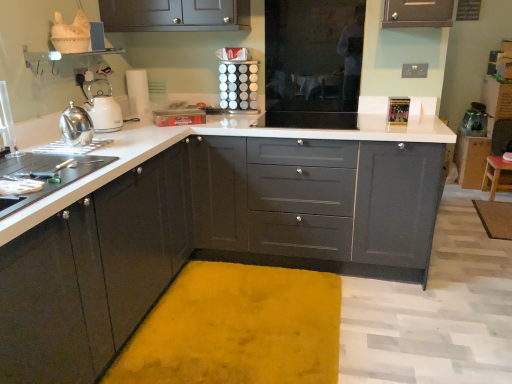
The height and width of the screenshot is (384, 512). Describe the element at coordinates (103, 108) in the screenshot. I see `white glossy kettle at left, which is counted as the 2th kitchen appliance, starting from the front` at that location.

At what (x,y) coordinates should I click in order to perform the action: click on white glossy kettle at left, which is counted as the 2th kitchen appliance, starting from the front. Please return your answer as a coordinate pair (x, y). This screenshot has height=384, width=512. Looking at the image, I should click on (103, 108).

What do you see at coordinates (237, 329) in the screenshot?
I see `yellow plush bath mat at center, which is counted as the 2th bath mat, starting from the right` at bounding box center [237, 329].

What is the approximate height of white glossy countertop at center?

white glossy countertop at center is 35.22 inches in height.

Locate an element on the screen. wooden stool at lower right is located at coordinates coord(497,176).

Does point (241, 80) lie in front of point (108, 97)?

No, (241, 80) is behind (108, 97).

Could you tell me if metallic silver spice rack at upper center is facing white glossy kettle at left, which appears as the first kitchen appliance when viewed from the back?

No, metallic silver spice rack at upper center is not oriented towards white glossy kettle at left, which appears as the first kitchen appliance when viewed from the back.

Is the position of metallic silver spice rack at upper center more distant than that of white glossy kettle at left, which appears as the first kitchen appliance when viewed from the back?

Yes.

Is metallic silver spice rack at upper center bigger or smaller than white glossy kettle at left, which is counted as the 2th kitchen appliance, starting from the front?

Considering their sizes, metallic silver spice rack at upper center takes up more space than white glossy kettle at left, which is counted as the 2th kitchen appliance, starting from the front.

From a real-world perspective, does matte gray cabinet at right, which is counted as the 3th cabinetry, starting from the left, stand above metallic silver spice rack at upper center?

Incorrect, from a real-world perspective, matte gray cabinet at right, which is counted as the 3th cabinetry, starting from the left, is lower than metallic silver spice rack at upper center.

Is matte gray cabinet at right, which ranks as the first cabinetry in back-to-front order, facing away from metallic silver spice rack at upper center?

matte gray cabinet at right, which ranks as the first cabinetry in back-to-front order, is not turned away from metallic silver spice rack at upper center.

Visually, is matte gray cabinet at right, which ranks as the first cabinetry in back-to-front order, positioned to the left or to the right of metallic silver spice rack at upper center?

matte gray cabinet at right, which ranks as the first cabinetry in back-to-front order, is positioned on metallic silver spice rack at upper center's right side.

Who is taller, wooden stool at lower right or yellow plush bath mat at lower right, the 2th bath mat viewed from the left?

Standing taller between the two is wooden stool at lower right.

Are wooden stool at lower right and yellow plush bath mat at lower right, the 1th bath mat from the top, located far from each other?

No, wooden stool at lower right is not far away from yellow plush bath mat at lower right, the 1th bath mat from the top.

Looking at their sizes, would you say wooden stool at lower right is wider or thinner than yellow plush bath mat at lower right, the 1th bath mat from the top?

In the image, wooden stool at lower right appears to be more narrow than yellow plush bath mat at lower right, the 1th bath mat from the top.

From a real-world perspective, is wooden stool at lower right positioned above or below yellow plush bath mat at lower right, the 2th bath mat viewed from the left?

wooden stool at lower right is situated higher than yellow plush bath mat at lower right, the 2th bath mat viewed from the left, in the real world.

Which is nearer, (81, 134) or (138, 363)?

Positioned in front is point (138, 363).

Does shiny metallic kettle at left, the 2th kitchen appliance when ordered from back to front, have a smaller size compared to yellow plush bath mat at center, positioned as the first bath mat in left-to-right order?

Yes.

Does shiny metallic kettle at left, acting as the first kitchen appliance starting from the front, have a greater height compared to yellow plush bath mat at center, the 2th bath mat positioned from the top?

Yes.

From the image's perspective, which one is positioned higher, shiny metallic kettle at left, the 2th kitchen appliance when ordered from back to front, or yellow plush bath mat at center, which is counted as the 2th bath mat, starting from the right?

shiny metallic kettle at left, the 2th kitchen appliance when ordered from back to front.

At what (x,y) coordinates should I click in order to perform the action: click on kitchen appliance that is the 1st object to the left of the yellow plush bath mat at center, which is counted as the 2th bath mat, starting from the right, starting at the anchor. Please return your answer as a coordinate pair (x, y). The image size is (512, 384). Looking at the image, I should click on (76, 126).

Can you confirm if yellow plush bath mat at center, placed as the 1th bath mat when sorted from front to back, is taller than shiny metallic kettle at left, the 2th kitchen appliance when ordered from back to front?

In fact, yellow plush bath mat at center, placed as the 1th bath mat when sorted from front to back, may be shorter than shiny metallic kettle at left, the 2th kitchen appliance when ordered from back to front.

Considering the points (297, 335) and (73, 142), which point is in front, point (297, 335) or point (73, 142)?

The point (73, 142) is more forward.

Locate an element on the screen. This screenshot has height=384, width=512. stool located underneath the matte gray cabinet at right, arranged as the third cabinetry when viewed from the front (from a real-world perspective) is located at coordinates (497, 176).

Looking at this image, from the image's perspective, which one is positioned lower, wooden stool at lower right or matte gray cabinet at right, which ranks as the first cabinetry in back-to-front order?

wooden stool at lower right is shown below in the image.

How many degrees apart are the facing directions of wooden stool at lower right and matte gray cabinet at right, which is counted as the 3th cabinetry, starting from the left?

The facing directions of wooden stool at lower right and matte gray cabinet at right, which is counted as the 3th cabinetry, starting from the left, are 2.92 degrees apart.

Can you confirm if wooden stool at lower right is smaller than matte gray cabinet at right, arranged as the third cabinetry when viewed from the front?

Correct, wooden stool at lower right occupies less space than matte gray cabinet at right, arranged as the third cabinetry when viewed from the front.

Is point (115, 131) closer to camera compared to point (432, 139)?

No, (115, 131) is further to viewer.

Looking at this image, considering the relative positions of white glossy kettle at left, which appears as the first kitchen appliance when viewed from the back, and white glossy countertop at center in the image provided, is white glossy kettle at left, which appears as the first kitchen appliance when viewed from the back, to the left of white glossy countertop at center from the viewer's perspective?

Indeed, white glossy kettle at left, which appears as the first kitchen appliance when viewed from the back, is positioned on the left side of white glossy countertop at center.

Between white glossy kettle at left, which is counted as the 2th kitchen appliance, starting from the front, and white glossy countertop at center, which one has larger width?

white glossy countertop at center.

Is white glossy kettle at left, which is counted as the 2th kitchen appliance, starting from the front, touching white glossy countertop at center?

white glossy kettle at left, which is counted as the 2th kitchen appliance, starting from the front, and white glossy countertop at center are clearly separated.

This screenshot has height=384, width=512. Find the location of `the 1st kitchen appliance positioned below the metallic silver spice rack at upper center (from the image's perspective)`. the 1st kitchen appliance positioned below the metallic silver spice rack at upper center (from the image's perspective) is located at coordinates (103, 108).

In order to click on appliance located in front of the matte gray cabinet at right, arranged as the third cabinetry when viewed from the front in this screenshot , I will do `click(238, 85)`.

When comparing their distances from matte black cabinets at left, the 3th cabinetry from the right, does shiny metallic kettle at left, acting as the first kitchen appliance starting from the front, or yellow plush bath mat at center, placed as the first bath mat when sorted from bottom to top, seem further?

shiny metallic kettle at left, acting as the first kitchen appliance starting from the front, is further to matte black cabinets at left, the 3th cabinetry from the right.

When comparing their distances from white glossy kettle at left, which appears as the first kitchen appliance when viewed from the back, does white glossy countertop at center or wooden stool at lower right seem further?

wooden stool at lower right is positioned further to the anchor white glossy kettle at left, which appears as the first kitchen appliance when viewed from the back.

Based on their spatial positions, is matte gray cabinet at right, which ranks as the first cabinetry in right-to-left order, or white glossy kettle at left, which is counted as the 2th kitchen appliance, starting from the front, closer to shiny metallic kettle at left, the 2th kitchen appliance when ordered from back to front?

white glossy kettle at left, which is counted as the 2th kitchen appliance, starting from the front, is positioned closer to the anchor shiny metallic kettle at left, the 2th kitchen appliance when ordered from back to front.

Considering their positions, is yellow plush bath mat at center, placed as the first bath mat when sorted from bottom to top, positioned further to white glossy countertop at center than yellow plush bath mat at lower right, which is counted as the first bath mat, starting from the back?

The object further to white glossy countertop at center is yellow plush bath mat at lower right, which is counted as the first bath mat, starting from the back.

In the scene shown: Based on their spatial positions, is matte gray cabinets at center, the second cabinetry positioned from the front, or white glossy kettle at left, which appears as the first kitchen appliance when viewed from the back, further from shiny metallic kettle at left, acting as the first kitchen appliance starting from the front?

The object further to shiny metallic kettle at left, acting as the first kitchen appliance starting from the front, is matte gray cabinets at center, the second cabinetry positioned from the front.

When comparing their distances from shiny metallic kettle at left, the 2th kitchen appliance when ordered from back to front, does matte gray cabinet at right, which is counted as the 3th cabinetry, starting from the left, or wooden stool at lower right seem further?

The object further to shiny metallic kettle at left, the 2th kitchen appliance when ordered from back to front, is wooden stool at lower right.

Considering their positions, is yellow plush bath mat at center, positioned as the first bath mat in left-to-right order, positioned closer to shiny metallic kettle at left, the 2th kitchen appliance when ordered from back to front, than matte gray cabinet at right, which ranks as the first cabinetry in right-to-left order?

yellow plush bath mat at center, positioned as the first bath mat in left-to-right order.

From the image, which object appears to be farther from white glossy countertop at center, matte black cabinets at left, the 3th cabinetry from the right, or white glossy kettle at left, which appears as the first kitchen appliance when viewed from the back?

Based on the image, white glossy kettle at left, which appears as the first kitchen appliance when viewed from the back, appears to be further to white glossy countertop at center.

Find the location of a particular element. The height and width of the screenshot is (384, 512). cabinetry located between white glossy kettle at left, which is counted as the 2th kitchen appliance, starting from the front, and matte gray cabinets at center, which is counted as the second cabinetry, starting from the back, in the left-right direction is located at coordinates (93, 273).

In order to click on appliance situated between white glossy kettle at left, which is counted as the 2th kitchen appliance, starting from the front, and matte gray cabinet at right, which ranks as the first cabinetry in back-to-front order, from left to right in this screenshot , I will do `click(238, 85)`.

Where is `appliance between shiny metallic kettle at left, acting as the first kitchen appliance starting from the front, and matte gray cabinets at center, which is counted as the second cabinetry, starting from the right, in the horizontal direction`? This screenshot has width=512, height=384. appliance between shiny metallic kettle at left, acting as the first kitchen appliance starting from the front, and matte gray cabinets at center, which is counted as the second cabinetry, starting from the right, in the horizontal direction is located at coordinates (238, 85).

This screenshot has height=384, width=512. In order to click on stool between metallic silver spice rack at upper center and matte gray cabinet at right, arranged as the third cabinetry when viewed from the front, from left to right in this screenshot , I will do point(497,176).